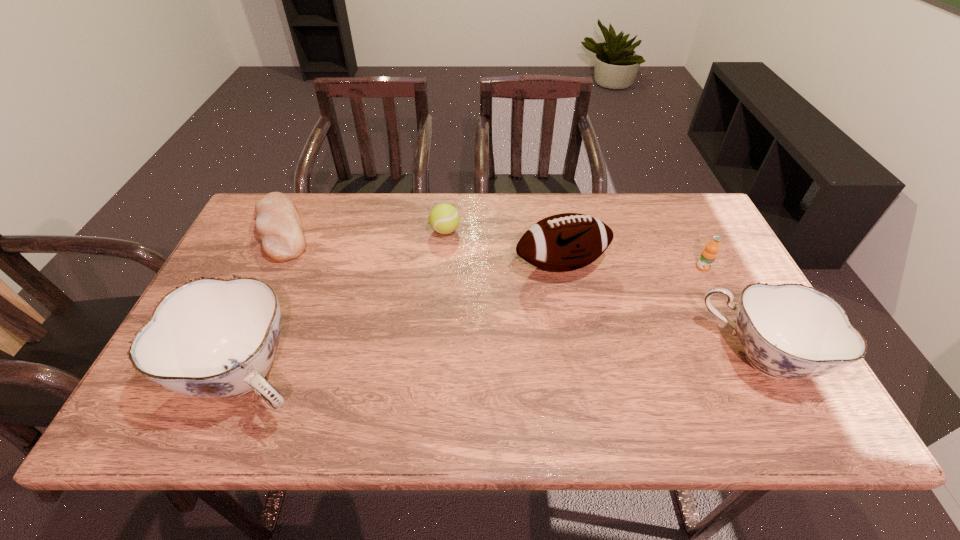
At what (x,y) coordinates should I click in order to perform the action: click on object located in the near left corner section of the desktop. Please return your answer as a coordinate pair (x, y). This screenshot has width=960, height=540. Looking at the image, I should click on tap(210, 338).

Locate an element on the screen. This screenshot has width=960, height=540. object located in the near right corner section of the desktop is located at coordinates (790, 331).

The image size is (960, 540). Identify the location of free space at the far edge of the desktop. (603, 214).

Where is `vacant space at the near edge of the desktop`? The width and height of the screenshot is (960, 540). vacant space at the near edge of the desktop is located at coordinates (494, 387).

The width and height of the screenshot is (960, 540). In order to click on free region at the right edge in this screenshot , I will do `click(684, 249)`.

Locate an element on the screen. The height and width of the screenshot is (540, 960). free space at the far left corner of the desktop is located at coordinates (289, 192).

Find the location of a particular element. The height and width of the screenshot is (540, 960). vacant space that is in between the shortest object and the third object from right to left is located at coordinates (422, 247).

Locate an element on the screen. The width and height of the screenshot is (960, 540). vacant point located between the bread and the orange juice is located at coordinates (492, 248).

Find the location of a particular element. The width and height of the screenshot is (960, 540). free point between the third object from right to left and the shortest object is located at coordinates (422, 247).

You are a GUI agent. You are given a task and a screenshot of the screen. Output one action in this format:
    pyautogui.click(x=<x>, y=<y>)
    Task: Click on the vacant space that's between the third shortest object and the third object from right to left
    The height and width of the screenshot is (540, 960).
    Given the screenshot: What is the action you would take?
    pyautogui.click(x=632, y=266)